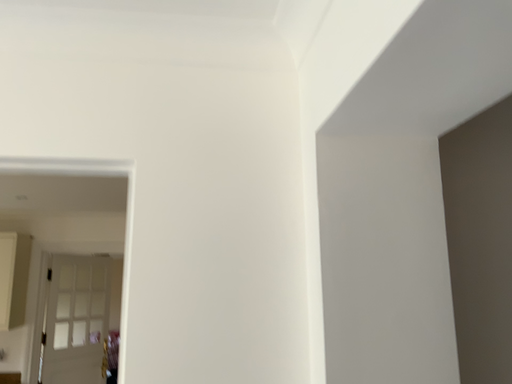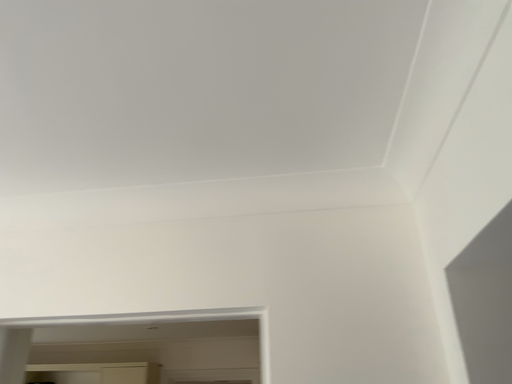
Question: How did the camera likely rotate when shooting the video?

Choices:
 (A) rotated left
 (B) rotated right

Answer: (A)